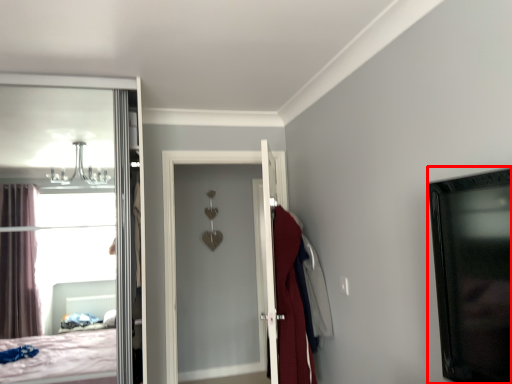
Question: From the image, what is the correct spatial relationship of picture frame (annotated by the red box) in relation to robe?

Choices:
 (A) right
 (B) left

Answer: (A)